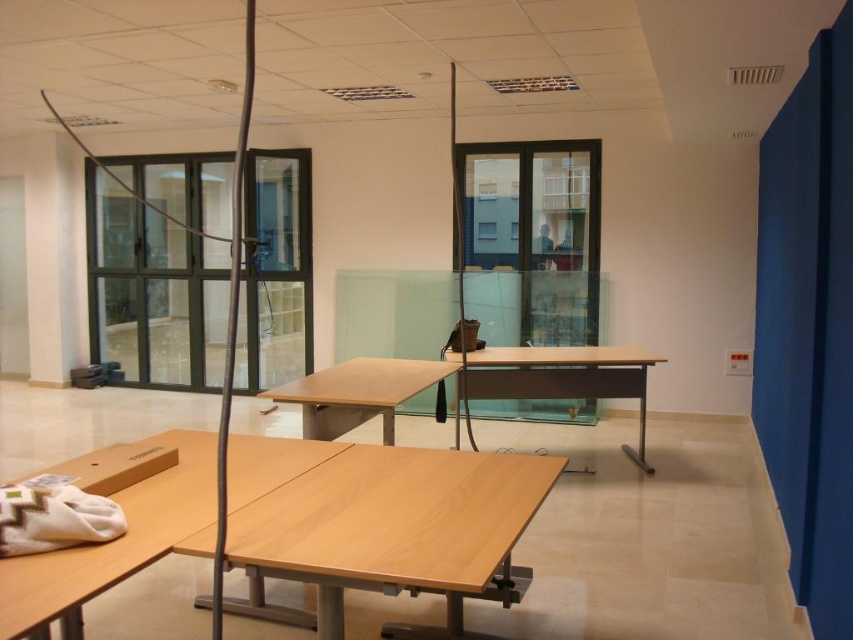
Question: Can you confirm if light brown wood table at center is wider than light wood table at center?

Choices:
 (A) yes
 (B) no

Answer: (A)

Question: Does clear glass door at center appear over light brown wood table at center?

Choices:
 (A) yes
 (B) no

Answer: (A)

Question: Which of the following is the farthest from the observer?

Choices:
 (A) (337, 433)
 (B) (566, 307)
 (C) (482, 394)
 (D) (161, 230)

Answer: (D)

Question: Is light brown wood table at center bigger than transparent glass door at center?

Choices:
 (A) no
 (B) yes

Answer: (A)

Question: Estimate the real-world distances between objects in this image. Which object is closer to the light brown wooden table at lower center?

Choices:
 (A) light wood table at center
 (B) light brown wooden table at center
 (C) transparent glass door at center
 (D) light brown wood table at center

Answer: (D)

Question: Which object is the farthest from the light wood table at center?

Choices:
 (A) transparent glass door at center
 (B) light brown wooden table at lower center
 (C) light brown wood table at center

Answer: (A)